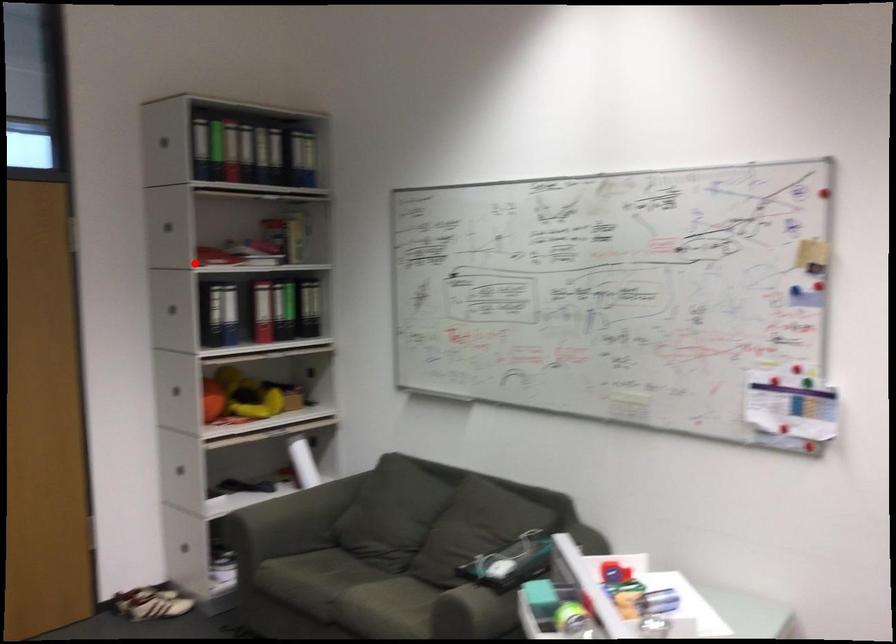
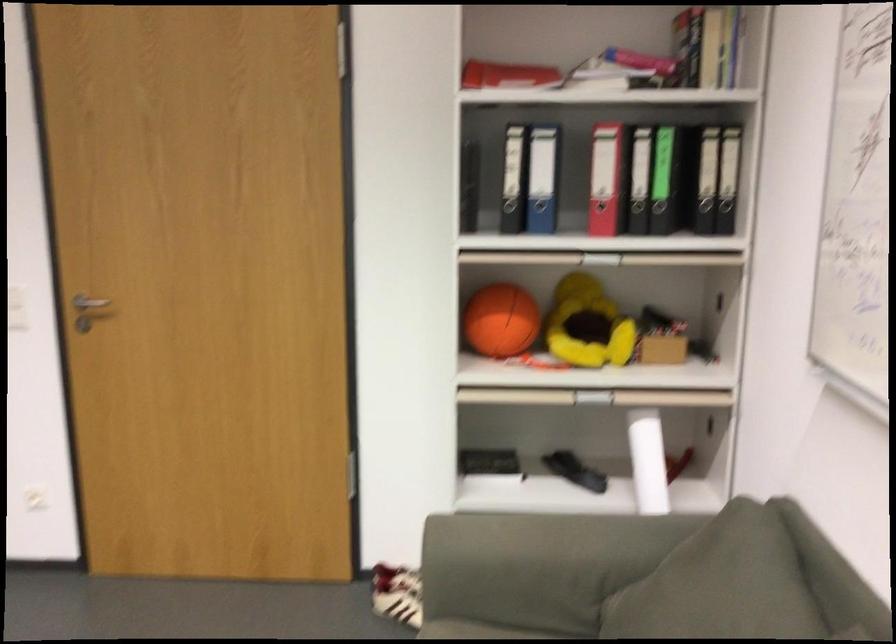
Locate, in the second image, the point that corresponds to the highlighted location in the first image.

(506, 75)